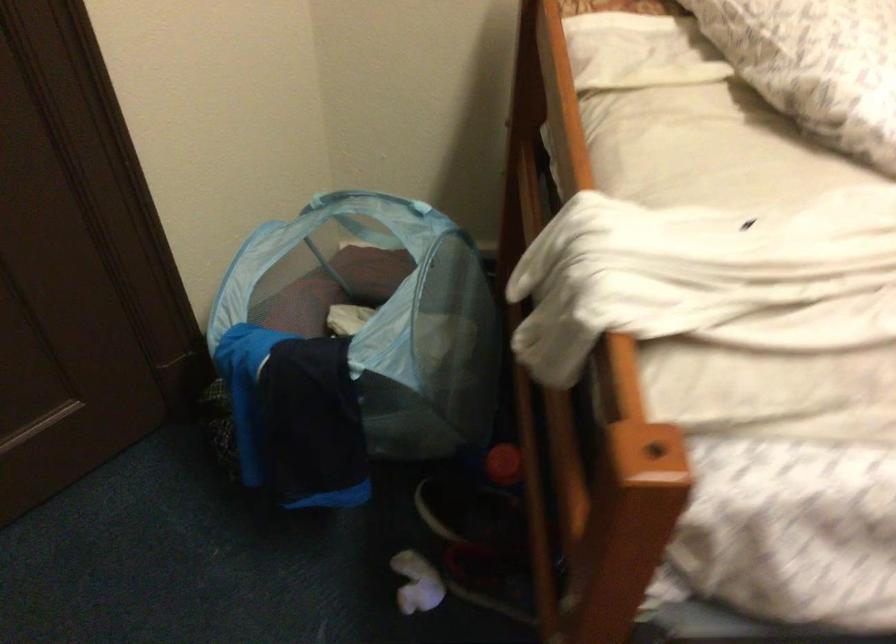
Locate an element on the screen. This screenshot has height=644, width=896. white sock is located at coordinates pyautogui.click(x=417, y=583).